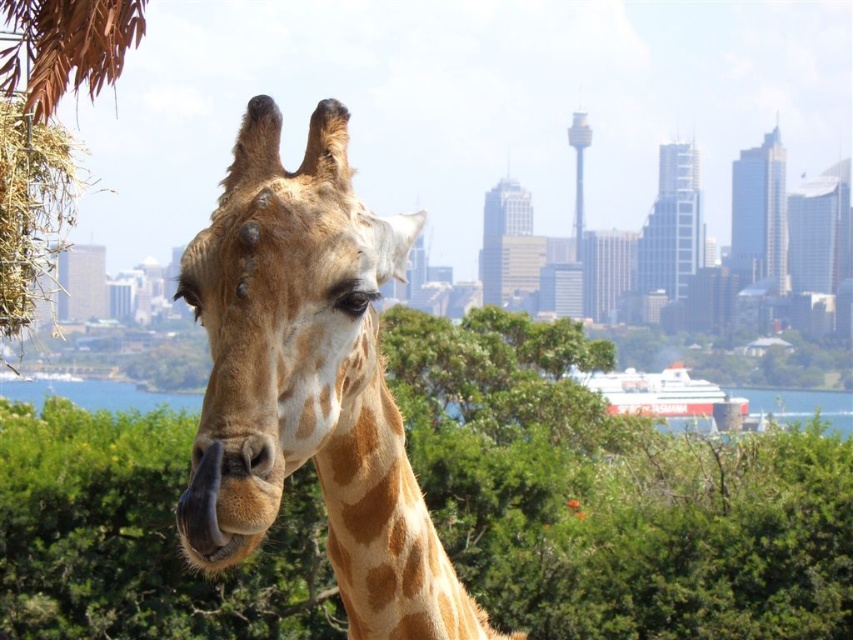
Is green leafy tree at center wider than spotted fur giraffe at center?

Yes, green leafy tree at center is wider than spotted fur giraffe at center.

Identify the location of green leafy tree at center. The image size is (853, 640). (613, 496).

Does green leafy tree at center have a smaller size compared to clear blue water at center?

No.

Is point (811, 442) behind point (845, 400)?

No.

Where is `green leafy tree at center`? The image size is (853, 640). green leafy tree at center is located at coordinates (613, 496).

At what (x,y) coordinates should I click in order to perform the action: click on green leafy tree at center. Please return your answer as a coordinate pair (x, y). The image size is (853, 640). Looking at the image, I should click on (613, 496).

Between point (344, 232) and point (787, 410), which one is positioned in front?

Point (344, 232) is more forward.

Does spotted fur giraffe at center have a larger size compared to clear blue water at center?

No, spotted fur giraffe at center is not bigger than clear blue water at center.

Is point (457, 600) in front of point (744, 392)?

Yes, it is.

At what (x,y) coordinates should I click in order to perform the action: click on spotted fur giraffe at center. Please return your answer as a coordinate pair (x, y). Looking at the image, I should click on (310, 381).